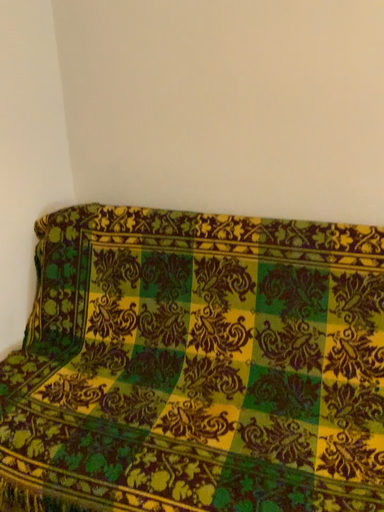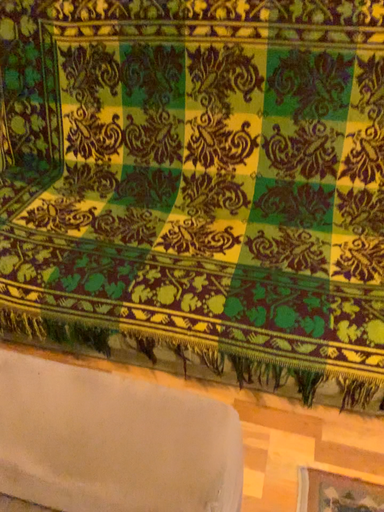
Question: Which way did the camera rotate in the video?

Choices:
 (A) rotated upward
 (B) rotated downward

Answer: (B)